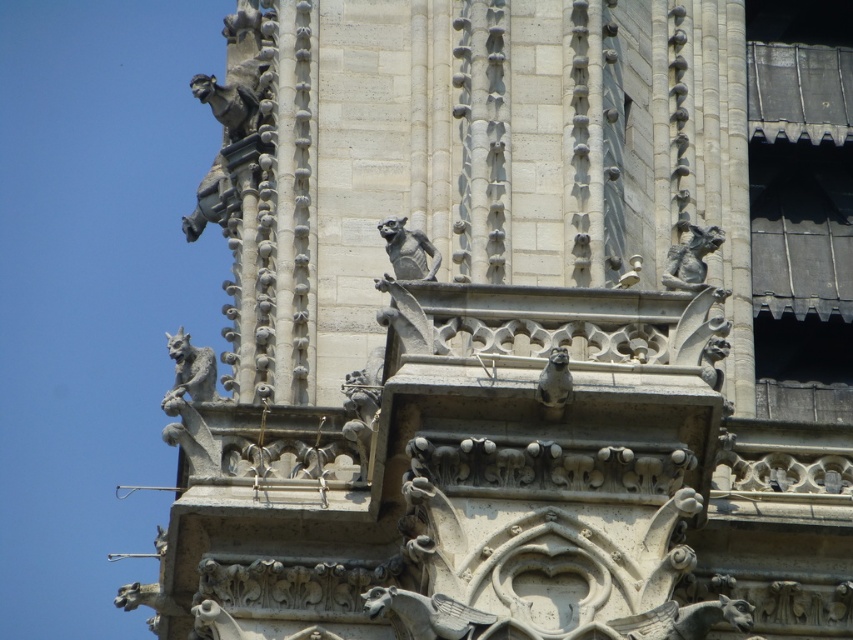
Looking at the Gothic structure, there are two gargoyles present. The first is a slate gray stone gargoyle at center, and the second is a matte stone gargoyle at center. Which of these two gargoyles is wider?

The slate gray stone gargoyle at center is wider than the matte stone gargoyle at center.

You are a maintenance worker needing to inspect two gargoyles on the cathedral facade. The first is the sculpted stone gargoyle at upper right, and the second is the matte stone gargoyle at center. If your ladder can extend up to 6 meters, can you safely reach both gargoyles without needing a taller ladder?

The distance between the sculpted stone gargoyle at upper right and the matte stone gargoyle at center is 6.29 meters. Since your ladder can only extend up to 6 meters, you cannot safely reach both gargoyles without needing a taller ladder.